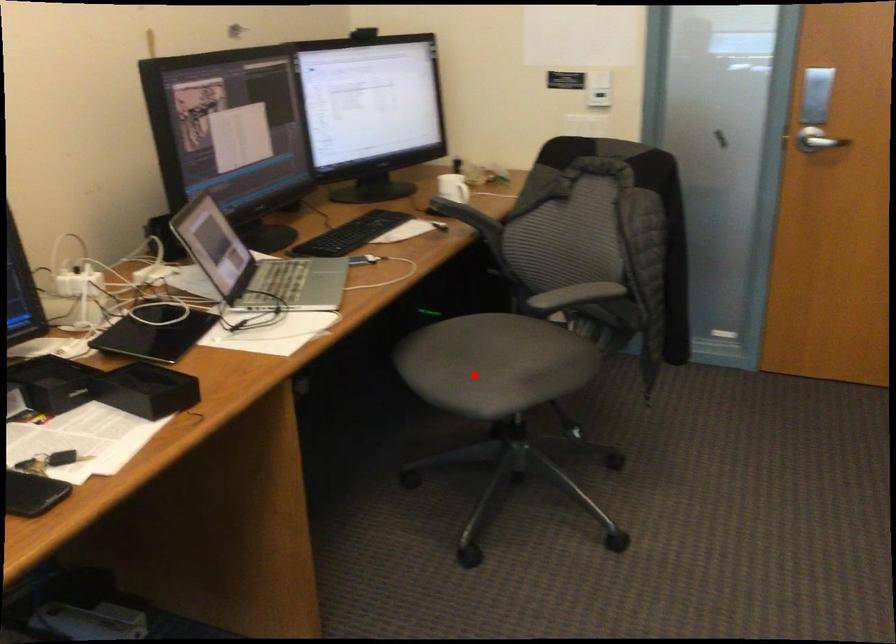
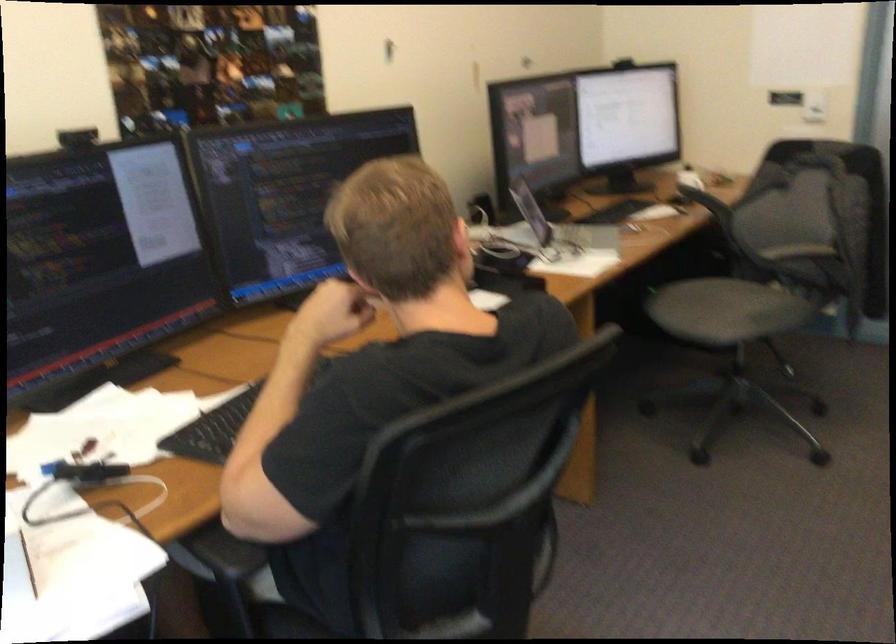
Question: I am providing you with two images of the same scene from different viewpoints. Given a red point in image1, look at the same physical point in image2. Is it:

Choices:
 (A) Closer to the viewpoint
 (B) Farther from the viewpoint

Answer: (B)